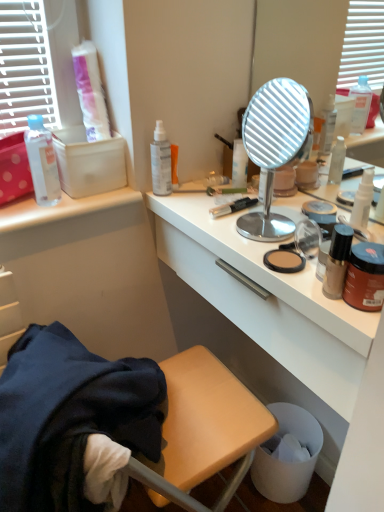
Where is `blank area to the left of metallic round mirror at center`? blank area to the left of metallic round mirror at center is located at coordinates (201, 219).